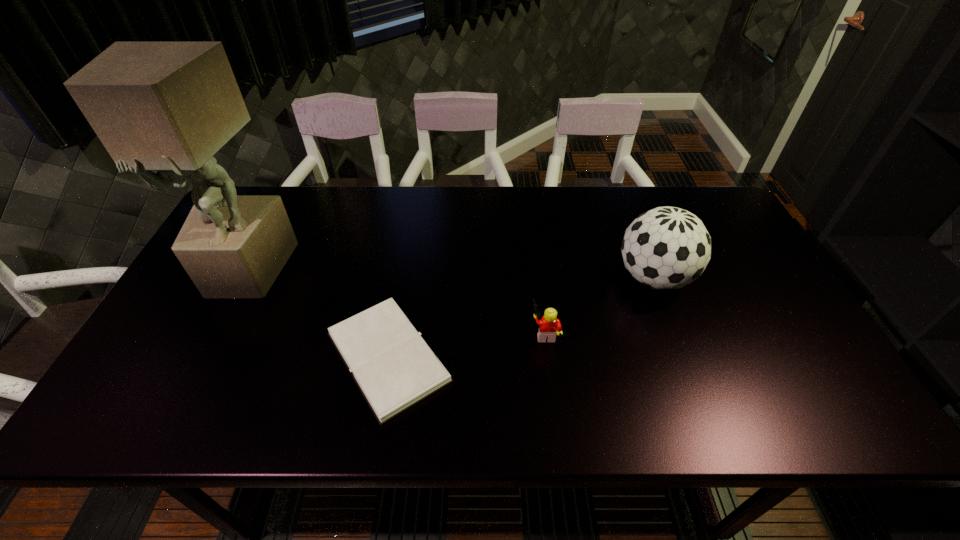
At what (x,y) coordinates should I click in order to perform the action: click on free spot between the sculpture and the third object from left to right. Please return your answer as a coordinate pair (x, y). Image resolution: width=960 pixels, height=540 pixels. Looking at the image, I should click on (396, 301).

Identify which object is the second nearest to the second tallest object. Please provide its 2D coordinates. Your answer should be formatted as a tuple, i.e. [(x, y)], where the tuple contains the x and y coordinates of a point satisfying the conditions above.

[(394, 368)]

Identify which object is located as the second nearest to the shortest object. Please provide its 2D coordinates. Your answer should be formatted as a tuple, i.e. [(x, y)], where the tuple contains the x and y coordinates of a point satisfying the conditions above.

[(548, 326)]

The image size is (960, 540). What are the coordinates of `free spot that satisfies the following two spatial constraints: 1. on the front-facing side of the tallest object; 2. on the left side of the rightmost object` in the screenshot? It's located at (244, 278).

Where is `free space that satisfies the following two spatial constraints: 1. on the front-facing side of the tallest object; 2. on the left side of the second object from left to right`? free space that satisfies the following two spatial constraints: 1. on the front-facing side of the tallest object; 2. on the left side of the second object from left to right is located at coordinates (203, 357).

The image size is (960, 540). Find the location of `blank area in the image that satisfies the following two spatial constraints: 1. on the front-facing side of the leftmost object; 2. on the right side of the rightmost object`. blank area in the image that satisfies the following two spatial constraints: 1. on the front-facing side of the leftmost object; 2. on the right side of the rightmost object is located at coordinates (244, 278).

The width and height of the screenshot is (960, 540). Identify the location of vacant area that satisfies the following two spatial constraints: 1. on the front-facing side of the leftmost object; 2. on the left side of the hardback book. (203, 357).

The width and height of the screenshot is (960, 540). What are the coordinates of `free space that satisfies the following two spatial constraints: 1. on the front-facing side of the sculpture; 2. on the right side of the hardback book` in the screenshot? It's located at (203, 357).